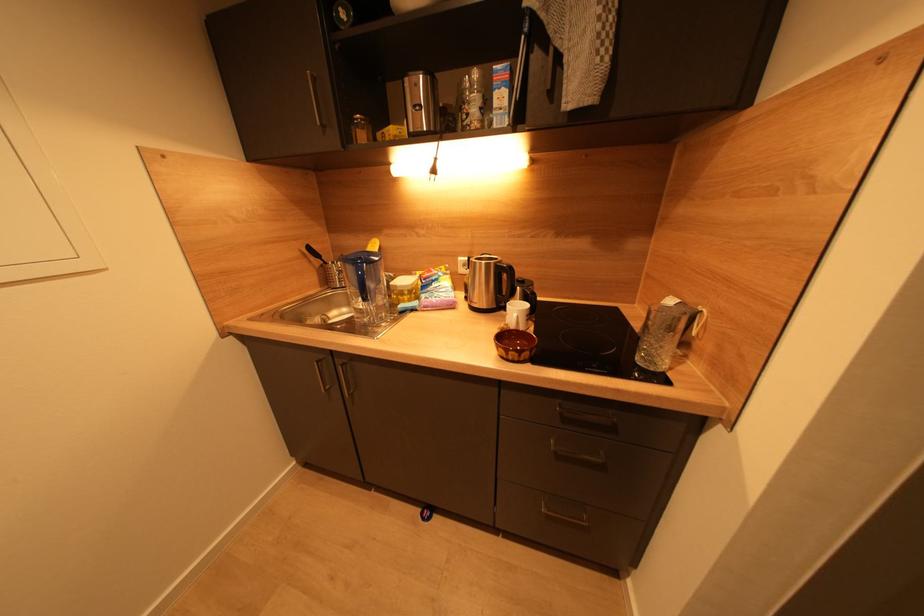
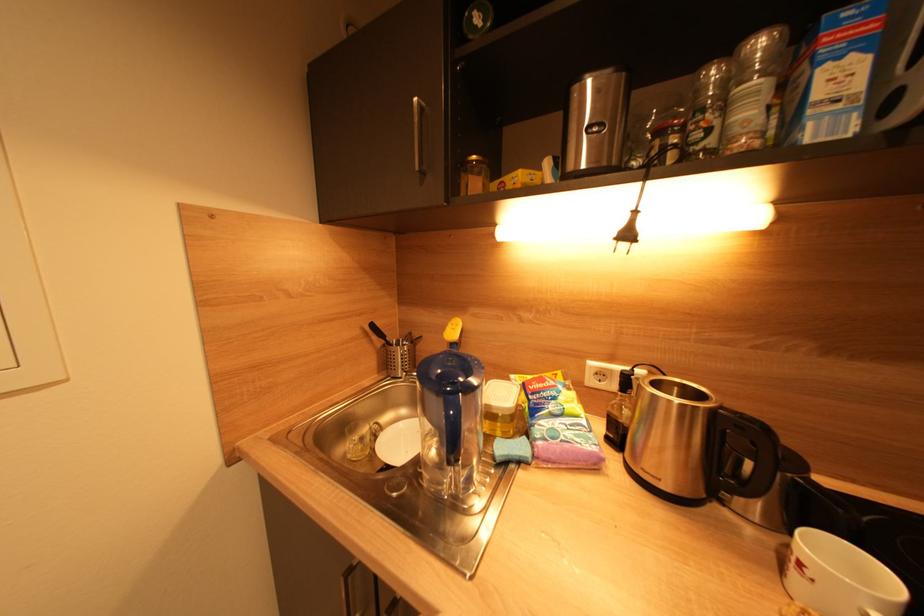
Which direction would the cameraman need to move to produce the second image?

The cameraman walked toward left, forward.